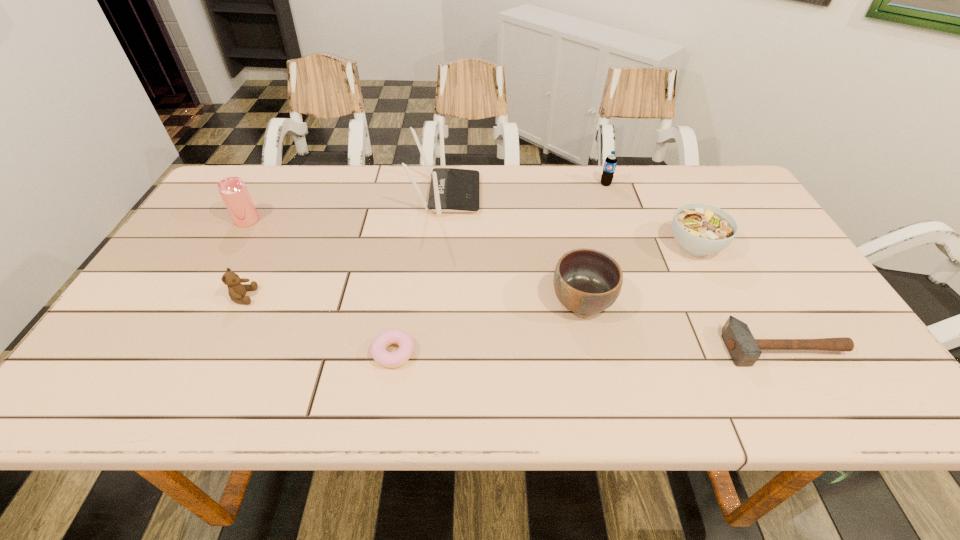
Locate an element on the screen. blank area located 0.240m on the left of the soda bottle is located at coordinates (524, 184).

At what (x,y) coordinates should I click in order to perform the action: click on vacant space located 0.080m on the right of the bowl. Please return your answer as a coordinate pair (x, y). Looking at the image, I should click on (647, 301).

Locate an element on the screen. vacant space situated 0.180m on the back of the soup bowl is located at coordinates (667, 191).

This screenshot has width=960, height=540. I want to click on free space located 0.190m on the front-facing side of the teddy bear, so click(x=334, y=296).

This screenshot has width=960, height=540. Find the location of `free space located 0.060m on the striking surface of the hammer`. free space located 0.060m on the striking surface of the hammer is located at coordinates (808, 393).

You are a GUI agent. You are given a task and a screenshot of the screen. Output one action in this format:
    pyautogui.click(x=<x>, y=<y>)
    Task: Click on the free spot located 0.060m on the right of the shortest object
    The image size is (960, 540).
    Given the screenshot: What is the action you would take?
    pyautogui.click(x=443, y=353)

Find the location of a particular element. router at the far edge is located at coordinates (451, 190).

You are a GUI agent. You are given a task and a screenshot of the screen. Output one action in this format:
    pyautogui.click(x=<x>, y=<y>)
    Task: Click on the soda bottle situated at the far edge
    The image size is (960, 540).
    Given the screenshot: What is the action you would take?
    pyautogui.click(x=610, y=162)

This screenshot has height=540, width=960. What are the coordinates of `object that is at the near edge` in the screenshot? It's located at (379, 353).

You are a GUI agent. You are given a task and a screenshot of the screen. Output one action in this format:
    pyautogui.click(x=<x>, y=<y>)
    Task: Click on the object that is at the left edge
    This screenshot has width=960, height=540.
    Given the screenshot: What is the action you would take?
    pyautogui.click(x=233, y=190)